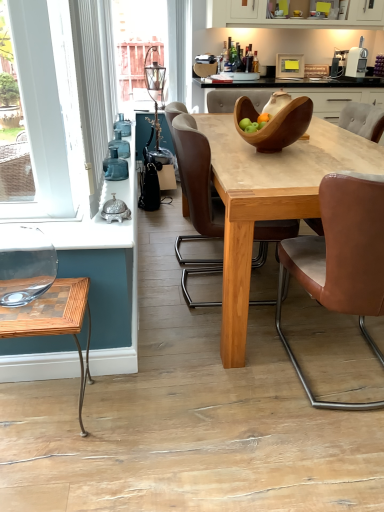
I want to click on vacant space in front of brown leather chair at center, which appears as the 2th chair when viewed from the left, so click(x=319, y=458).